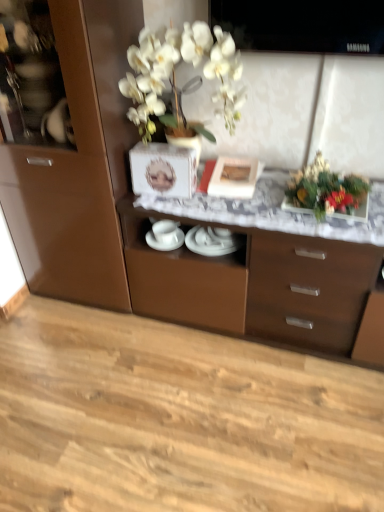
Question: Is shiny metallic vase at upper right thinner than brown glossy cabinet at center?

Choices:
 (A) no
 (B) yes

Answer: (B)

Question: Would you say brown glossy cabinet at center is part of shiny metallic vase at upper right's contents?

Choices:
 (A) yes
 (B) no

Answer: (B)

Question: Is shiny metallic vase at upper right aimed at brown glossy cabinet at center?

Choices:
 (A) no
 (B) yes

Answer: (A)

Question: Does shiny metallic vase at upper right have a greater height compared to brown glossy cabinet at center?

Choices:
 (A) no
 (B) yes

Answer: (A)

Question: Is shiny metallic vase at upper right behind brown glossy cabinet at center?

Choices:
 (A) no
 (B) yes

Answer: (B)

Question: Is shiny metallic vase at upper right wider or thinner than white glossy plates at center, acting as the 1th tableware starting from the left?

Choices:
 (A) thin
 (B) wide

Answer: (B)

Question: From a real-world perspective, relative to white glossy plates at center, the 2th tableware from the right, is shiny metallic vase at upper right vertically above or below?

Choices:
 (A) above
 (B) below

Answer: (A)

Question: Considering the positions of shiny metallic vase at upper right and white glossy plates at center, the 2th tableware from the right, in the image, is shiny metallic vase at upper right bigger or smaller than white glossy plates at center, the 2th tableware from the right,?

Choices:
 (A) big
 (B) small

Answer: (A)

Question: Is shiny metallic vase at upper right inside the boundaries of white glossy plates at center, the 2th tableware from the right, or outside?

Choices:
 (A) outside
 (B) inside

Answer: (A)

Question: Do you think natural wood floor at lower center is within white glossy plates at center, which appears as the 1th tableware when viewed from the right, or outside of it?

Choices:
 (A) inside
 (B) outside

Answer: (B)

Question: From a real-world perspective, is natural wood floor at lower center physically located above or below white glossy plates at center, which appears as the 1th tableware when viewed from the right?

Choices:
 (A) above
 (B) below

Answer: (B)

Question: Visually, is natural wood floor at lower center positioned to the left or to the right of white glossy plates at center, positioned as the second tableware in left-to-right order?

Choices:
 (A) right
 (B) left

Answer: (B)

Question: In the image, is natural wood floor at lower center positioned in front of or behind white glossy plates at center, positioned as the second tableware in left-to-right order?

Choices:
 (A) behind
 (B) front

Answer: (B)

Question: Considering their positions, is matte white picture frame at center located in front of or behind natural wood floor at lower center?

Choices:
 (A) front
 (B) behind

Answer: (B)

Question: Is matte white picture frame at center to the left or to the right of natural wood floor at lower center in the image?

Choices:
 (A) left
 (B) right

Answer: (B)